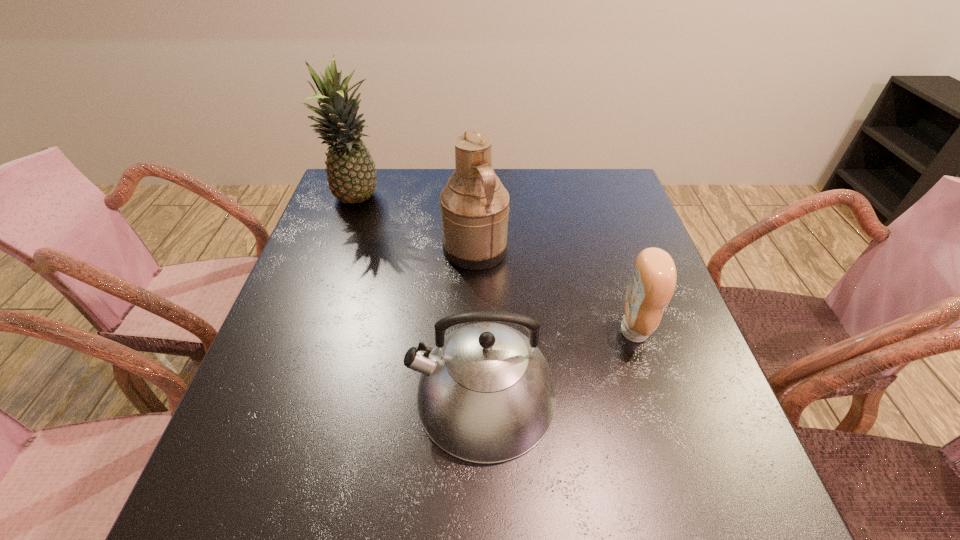
Locate an element on the screen. This screenshot has height=540, width=960. the farthest object is located at coordinates (351, 174).

This screenshot has height=540, width=960. I want to click on pineapple, so click(x=351, y=174).

The height and width of the screenshot is (540, 960). I want to click on the second tallest object, so click(474, 204).

Find the location of a particular element. pitcher is located at coordinates (474, 204).

Find the location of a particular element. The image size is (960, 540). kettle is located at coordinates (486, 394).

The image size is (960, 540). I want to click on condiment, so click(x=653, y=280).

Where is `vacant space situated 0.080m on the front of the tallest object`? vacant space situated 0.080m on the front of the tallest object is located at coordinates (346, 237).

Locate an element on the screen. This screenshot has height=540, width=960. blank space located 0.220m on the front of the third shortest object is located at coordinates (474, 346).

Find the location of a particular element. The image size is (960, 540). vacant space located 0.210m from the spout of the kettle is located at coordinates (298, 395).

At what (x,y) coordinates should I click in order to perform the action: click on vacant region located 0.170m from the spout of the kettle. Please return your answer as a coordinate pair (x, y). This screenshot has width=960, height=540. Looking at the image, I should click on (320, 395).